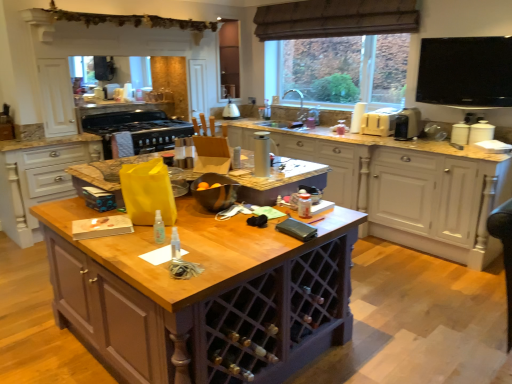
The height and width of the screenshot is (384, 512). In order to click on free space in front of metallic silver toaster at right in this screenshot , I will do `click(419, 140)`.